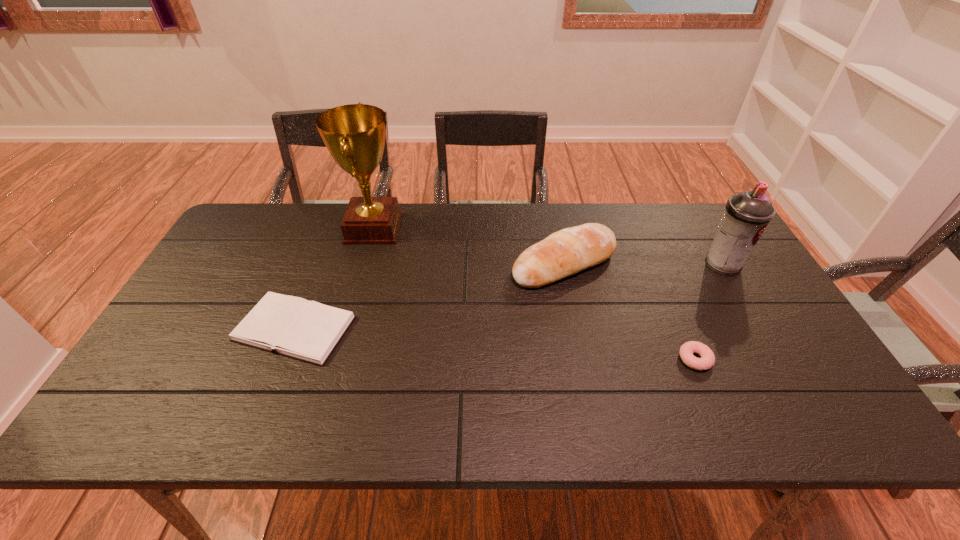
Where is `free space between the fourth shortest object and the third object from right to left`? free space between the fourth shortest object and the third object from right to left is located at coordinates (643, 264).

Where is `free space between the hardback book and the third object from right to left`? The height and width of the screenshot is (540, 960). free space between the hardback book and the third object from right to left is located at coordinates (429, 296).

In order to click on free point between the fourth object from left to right and the third shortest object in this screenshot , I will do `click(630, 312)`.

I want to click on vacant area between the aerosol can and the doughnut, so click(708, 312).

Where is `free space between the tallest object and the hardback book`? This screenshot has width=960, height=540. free space between the tallest object and the hardback book is located at coordinates (334, 279).

Where is `blank region between the hardback book and the second object from right to left`? This screenshot has width=960, height=540. blank region between the hardback book and the second object from right to left is located at coordinates (494, 344).

This screenshot has height=540, width=960. I want to click on free point between the third tallest object and the doughnut, so click(630, 312).

Where is `free space between the doughnut and the bread`? free space between the doughnut and the bread is located at coordinates (630, 312).

You are a GUI agent. You are given a task and a screenshot of the screen. Output one action in this format:
    pyautogui.click(x=<x>, y=<y>)
    Task: Click on the vacant area that lies between the tallest object and the fourth object from left to right
    
    Given the screenshot: What is the action you would take?
    pyautogui.click(x=535, y=294)

The image size is (960, 540). Identify the location of the fourth closest object to the second tallest object. (309, 331).